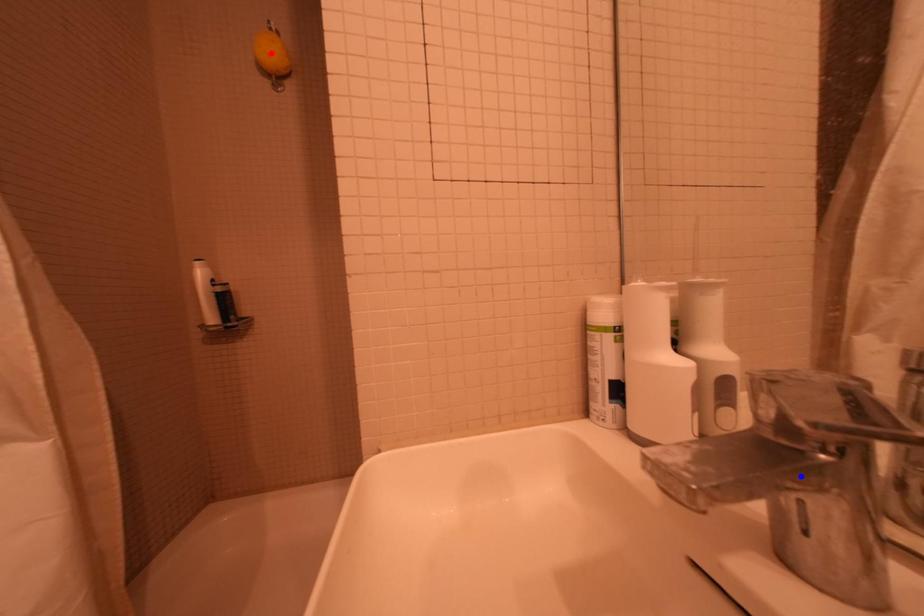
Question: Which of the two points in the image is closer to the camera?

Choices:
 (A) Blue point is closer.
 (B) Red point is closer.

Answer: (A)